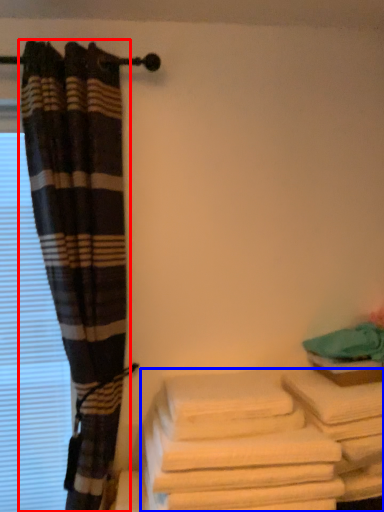
Question: Which object appears farthest to the camera in this image, curtain (highlighted by a red box) or towel (highlighted by a blue box)?

Choices:
 (A) curtain
 (B) towel

Answer: (A)